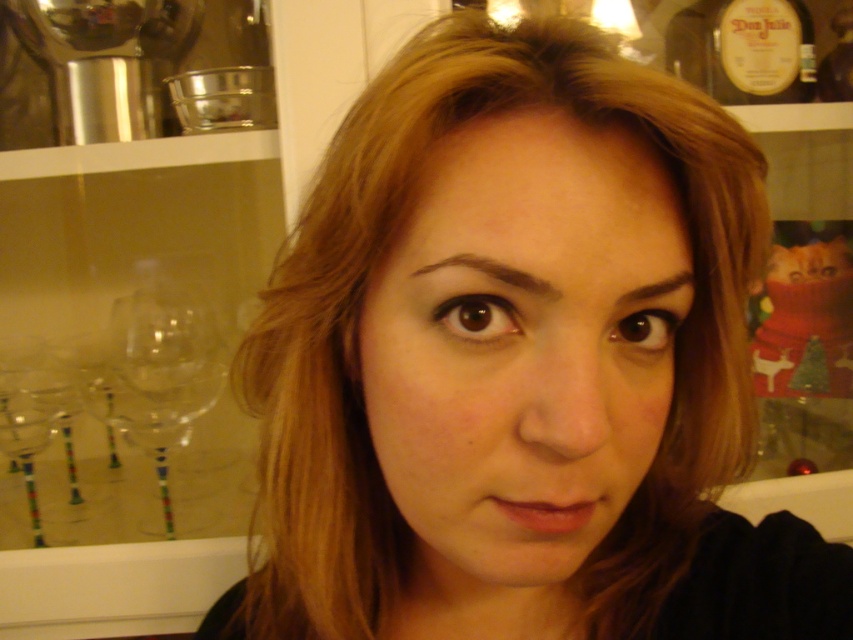
Question: Is transparent glass wine glass at left thinner than matte glass bottle at upper right?

Choices:
 (A) yes
 (B) no

Answer: (B)

Question: Does transparent glass wine glass at left have a smaller size compared to matte glass bottle at upper right?

Choices:
 (A) yes
 (B) no

Answer: (B)

Question: Among these points, which one is nearest to the camera?

Choices:
 (A) (137, 337)
 (B) (769, 68)

Answer: (B)

Question: Which of the following is the closest to the observer?

Choices:
 (A) (706, 52)
 (B) (151, 314)

Answer: (A)

Question: Does transparent glass wine glass at left appear over matte glass bottle at upper right?

Choices:
 (A) no
 (B) yes

Answer: (A)